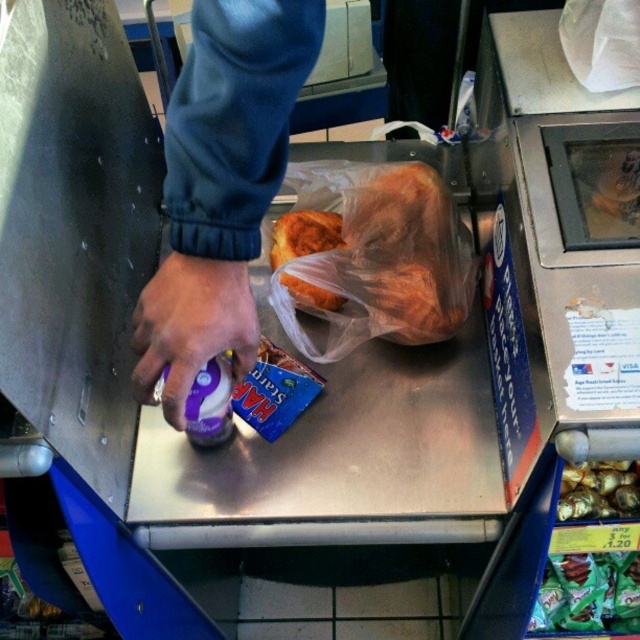
Question: Does golden brown bread at center have a greater width compared to green matte candy at lower right?

Choices:
 (A) yes
 (B) no

Answer: (A)

Question: Does green matte candy at lower right have a larger size compared to shiny gold foil at center?

Choices:
 (A) no
 (B) yes

Answer: (A)

Question: Which point is farther from the camera taking this photo?

Choices:
 (A) (630, 497)
 (B) (572, 572)
 (C) (308, 304)

Answer: (B)

Question: Which point appears closest to the camera in this image?

Choices:
 (A) (592, 515)
 (B) (442, 193)

Answer: (A)

Question: Considering the relative positions of golden brown bread at center and shiny gold foil at center in the image provided, where is golden brown bread at center located with respect to shiny gold foil at center?

Choices:
 (A) below
 (B) above

Answer: (B)

Question: Among these points, which one is farthest from the camera?

Choices:
 (A) (326, 196)
 (B) (620, 476)

Answer: (A)